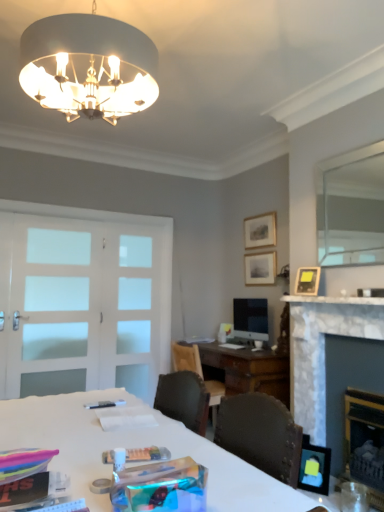
Question: Visually, is matte black picture frame at lower right, which is the 4th picture frame from top to bottom, positioned to the left or to the right of marble fireplace at right?

Choices:
 (A) right
 (B) left

Answer: (B)

Question: Considering the positions of point (299, 474) and point (322, 348), is point (299, 474) closer or farther from the camera than point (322, 348)?

Choices:
 (A) closer
 (B) farther

Answer: (A)

Question: Considering the real-world distances, which object is closest to the white frosted glass screen door at center, marked as the first screen door in a right-to-left arrangement?

Choices:
 (A) marble fireplace at right
 (B) gold-framed picture at upper center, which is the 4th picture frame from bottom to top
 (C) matte black picture frame at upper right, marked as the third picture frame in a top-to-bottom arrangement
 (D) clear glass mirror at upper right
 (E) matte black picture frame at lower right, arranged as the 1th picture frame when ordered from the bottom

Answer: (B)

Question: Estimate the real-world distances between objects in this image. Which object is farther from the matte black picture frame at lower right, which is counted as the 1th picture frame, starting from the front?

Choices:
 (A) matte black picture frame at upper right, which appears as the third picture frame when viewed from the back
 (B) marble fireplace at right
 (C) white frosted glass door at left, the second screen door when ordered from right to left
 (D) white glossy desk at center
 (E) matte silver picture frame at upper center, positioned as the 2th picture frame in top-to-bottom order

Answer: (C)